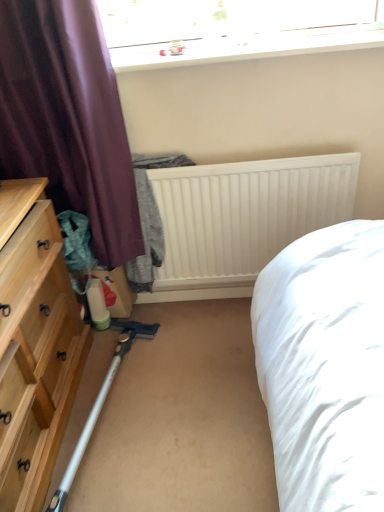
Image resolution: width=384 pixels, height=512 pixels. In order to click on free space above transparent glass window at upper center (from a real-world perspective) in this screenshot , I will do `click(246, 46)`.